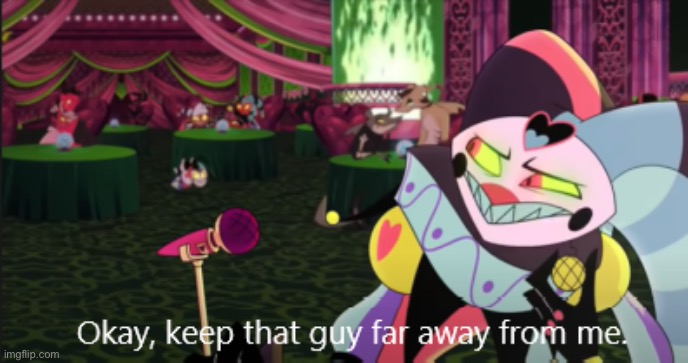
What are the coordinates of `table` in the screenshot? It's located at (73, 166), (122, 127), (219, 145), (307, 132), (358, 173).